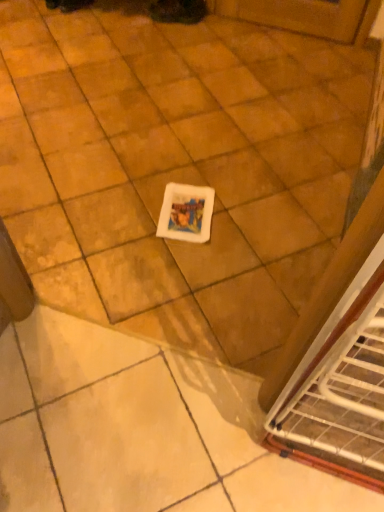
What do you see at coordinates (178, 11) in the screenshot? I see `matte black shoe at upper center` at bounding box center [178, 11].

Identify the location of matte black shoe at upper center. The width and height of the screenshot is (384, 512). (178, 11).

Identify the location of white matte tile at center. tap(177, 168).

What do you see at coordinates (177, 168) in the screenshot?
I see `white matte tile at center` at bounding box center [177, 168].

Locate an element on the screen. The image size is (384, 512). matte black shoe at upper center is located at coordinates [x=178, y=11].

Is matte black shoe at upper center at the right side of white matte tile at center?

Yes.

Considering the relative positions of matte black shoe at upper center and white matte tile at center in the image provided, is matte black shoe at upper center behind white matte tile at center?

Answer: Yes, matte black shoe at upper center is further from the viewer.

Which point is more forward, [175,19] or [236,177]?

Point [236,177]

From the image's perspective, is matte black shoe at upper center located beneath white matte tile at center?

No, from the image's perspective, matte black shoe at upper center is not beneath white matte tile at center.

From a real-world perspective, is matte black shoe at upper center beneath white matte tile at center?

No, from a real-world perspective, matte black shoe at upper center is not under white matte tile at center.

Considering the sizes of objects matte black shoe at upper center and white matte tile at center in the image provided, who is wider, matte black shoe at upper center or white matte tile at center?

white matte tile at center.

Does matte black shoe at upper center have a lesser height compared to white matte tile at center?

In fact, matte black shoe at upper center may be taller than white matte tile at center.

Who is bigger, matte black shoe at upper center or white matte tile at center?

Bigger between the two is white matte tile at center.

Is matte black shoe at upper center completely or partially outside of white matte tile at center?

Yes, matte black shoe at upper center is not within white matte tile at center.

Is there a large distance between matte black shoe at upper center and white matte tile at center?

Yes, matte black shoe at upper center and white matte tile at center are quite far apart.

Is white matte tile at center at the back of matte black shoe at upper center?

matte black shoe at upper center is not turned away from white matte tile at center.

Where is `footwear on the right side of white matte tile at center`? The height and width of the screenshot is (512, 384). footwear on the right side of white matte tile at center is located at coordinates (178, 11).

Is white matte tile at center to the left of matte black shoe at upper center from the viewer's perspective?

Correct, you'll find white matte tile at center to the left of matte black shoe at upper center.

Between white matte tile at center and matte black shoe at upper center, which one is positioned behind?

matte black shoe at upper center.

Considering the positions of points (111, 264) and (166, 19), is point (111, 264) farther from camera compared to point (166, 19)?

That is False.

From the image's perspective, who appears lower, white matte tile at center or matte black shoe at upper center?

white matte tile at center is shown below in the image.

From a real-world perspective, is white matte tile at center physically located above or below matte black shoe at upper center?

white matte tile at center is below matte black shoe at upper center.

Does white matte tile at center have a lesser width compared to matte black shoe at upper center?

No, white matte tile at center is not thinner than matte black shoe at upper center.

Does white matte tile at center have a lesser height compared to matte black shoe at upper center?

Yes.

Considering the sizes of objects white matte tile at center and matte black shoe at upper center in the image provided, who is smaller, white matte tile at center or matte black shoe at upper center?

matte black shoe at upper center.

From the picture: Is white matte tile at center situated inside matte black shoe at upper center or outside?

white matte tile at center is not inside matte black shoe at upper center, it's outside.

Is white matte tile at center in contact with matte black shoe at upper center?

No, white matte tile at center is not with matte black shoe at upper center.

Is white matte tile at center aimed at matte black shoe at upper center?

No, white matte tile at center is not turned towards matte black shoe at upper center.

Locate an element on the screen. Image resolution: width=384 pixels, height=512 pixels. ceramic tile on the left of matte black shoe at upper center is located at coordinates (177, 168).

This screenshot has height=512, width=384. In order to click on ceramic tile on the left of the matte black shoe at upper center in this screenshot , I will do `click(177, 168)`.

Identify the location of footwear that is above the white matte tile at center (from a real-world perspective). The image size is (384, 512). (178, 11).